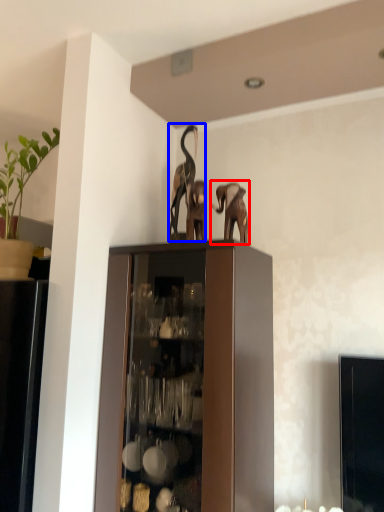
Question: Which object is closer to the camera taking this photo, elephant (highlighted by a red box) or animal (highlighted by a blue box)?

Choices:
 (A) elephant
 (B) animal

Answer: (A)